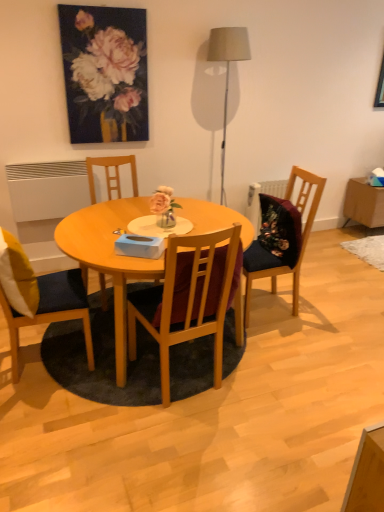
Where is `free point below wooden chair at left, the 1th chair positioned from the left (from a real-world perspective)`? The image size is (384, 512). free point below wooden chair at left, the 1th chair positioned from the left (from a real-world perspective) is located at coordinates (36, 359).